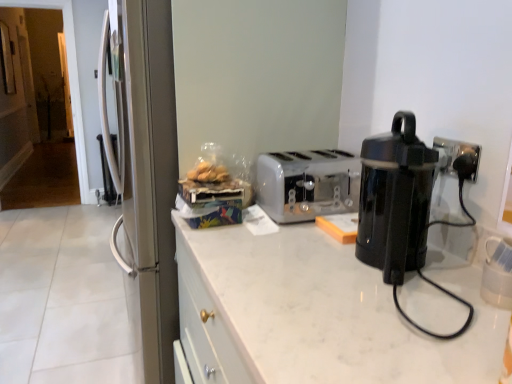
In order to click on translucent plastic bag of bread at center in this screenshot , I will do `click(208, 173)`.

Locate an element on the screen. white plastic toaster at center is located at coordinates (307, 184).

Image resolution: width=512 pixels, height=384 pixels. Describe the element at coordinates (403, 206) in the screenshot. I see `black plastic coffee pot at right` at that location.

What is the approximate height of white marble countertop at center?

white marble countertop at center is 33.45 inches tall.

Where is `translucent plastic bag of bread at center`? Image resolution: width=512 pixels, height=384 pixels. translucent plastic bag of bread at center is located at coordinates (208, 173).

How different are the orientations of white plastic toaster at center and black plastic coffee pot at right in degrees?

The angular difference between white plastic toaster at center and black plastic coffee pot at right is 89.2 degrees.

Which object is further away from the camera, white plastic toaster at center or black plastic coffee pot at right?

white plastic toaster at center is further from the camera.

Are white plastic toaster at center and black plastic coffee pot at right far apart?

No, there isn't a large distance between white plastic toaster at center and black plastic coffee pot at right.

From the image's perspective, is white plastic toaster at center on top of black plastic coffee pot at right?

Yes, from the image's perspective, white plastic toaster at center is on top of black plastic coffee pot at right.

Is white plastic toaster at center spatially inside white marble countertop at center, or outside of it?

white plastic toaster at center lies outside white marble countertop at center.

Could you tell me if white plastic toaster at center is turned towards white marble countertop at center?

No, white plastic toaster at center is not turned towards white marble countertop at center.

Locate an element on the screen. The width and height of the screenshot is (512, 384). toaster located above the white marble countertop at center (from a real-world perspective) is located at coordinates (307, 184).

Are white plastic toaster at center and translucent plastic bag of bread at center beside each other?

There is a gap between white plastic toaster at center and translucent plastic bag of bread at center.

Measure the distance from white plastic toaster at center to translucent plastic bag of bread at center.

11.41 inches.

Is white plastic toaster at center facing away from translucent plastic bag of bread at center?

That's not correct — white plastic toaster at center is not looking away from translucent plastic bag of bread at center.

From the image's perspective, is white plastic toaster at center beneath translucent plastic bag of bread at center?

Yes.

In terms of height, does white marble countertop at center look taller or shorter compared to white plastic toaster at center?

In the image, white marble countertop at center appears to be taller than white plastic toaster at center.

Which object is positioned more to the right, white marble countertop at center or white plastic toaster at center?

From the viewer's perspective, white marble countertop at center appears more on the right side.

In terms of width, does white marble countertop at center look wider or thinner when compared to white plastic toaster at center?

Clearly, white marble countertop at center has more width compared to white plastic toaster at center.

Identify the location of countertop below the white plastic toaster at center (from a real-world perspective). (315, 314).

Can you confirm if translucent plastic bag of bread at center is shorter than white plastic toaster at center?

Indeed, translucent plastic bag of bread at center has a lesser height compared to white plastic toaster at center.

Does translucent plastic bag of bread at center come behind white plastic toaster at center?

Yes, it is behind white plastic toaster at center.

I want to click on food above the white plastic toaster at center (from a real-world perspective), so click(208, 173).

Is white marble countertop at center located outside black plastic coffee pot at right?

Indeed, white marble countertop at center is completely outside black plastic coffee pot at right.

Does white marble countertop at center come in front of black plastic coffee pot at right?

Yes, white marble countertop at center is closer to the camera.

Is white marble countertop at center oriented away from black plastic coffee pot at right?

white marble countertop at center does not have its back to black plastic coffee pot at right.

Considering the relative positions of translucent plastic bag of bread at center and white marble countertop at center in the image provided, is translucent plastic bag of bread at center to the right of white marble countertop at center from the viewer's perspective?

Incorrect, translucent plastic bag of bread at center is not on the right side of white marble countertop at center.

Does translucent plastic bag of bread at center have a larger size compared to white marble countertop at center?

No.

Is white marble countertop at center a part of translucent plastic bag of bread at center?

Actually, white marble countertop at center is outside translucent plastic bag of bread at center.

Locate an element on the screen. food positioned vertically above the white marble countertop at center (from a real-world perspective) is located at coordinates (208, 173).

Identify the location of toaster that is under the black plastic coffee pot at right (from a real-world perspective). (307, 184).

Image resolution: width=512 pixels, height=384 pixels. I want to click on countertop in front of the white plastic toaster at center, so click(315, 314).

Based on the photo, considering their positions, is translucent plastic bag of bread at center positioned closer to white marble countertop at center than black plastic coffee pot at right?

Among the two, black plastic coffee pot at right is located nearer to white marble countertop at center.

From the image, which object appears to be nearer to white marble countertop at center, black plastic coffee pot at right or translucent plastic bag of bread at center?

Based on the image, black plastic coffee pot at right appears to be nearer to white marble countertop at center.

Which object lies further to the anchor point translucent plastic bag of bread at center, black plastic coffee pot at right or white marble countertop at center?

The object further to translucent plastic bag of bread at center is black plastic coffee pot at right.

Considering their positions, is white marble countertop at center positioned closer to translucent plastic bag of bread at center than white plastic toaster at center?

white plastic toaster at center lies closer to translucent plastic bag of bread at center than the other object.

Considering their positions, is black plastic coffee pot at right positioned further to translucent plastic bag of bread at center than white plastic toaster at center?

black plastic coffee pot at right is further to translucent plastic bag of bread at center.

When comparing their distances from translucent plastic bag of bread at center, does white marble countertop at center or black plastic coffee pot at right seem closer?

white marble countertop at center is positioned closer to the anchor translucent plastic bag of bread at center.

Looking at the image, which one is located closer to white plastic toaster at center, translucent plastic bag of bread at center or black plastic coffee pot at right?

translucent plastic bag of bread at center is closer to white plastic toaster at center.

Looking at the image, which one is located further to white marble countertop at center, translucent plastic bag of bread at center or white plastic toaster at center?

translucent plastic bag of bread at center lies further to white marble countertop at center than the other object.

At what (x,y) coordinates should I click in order to perform the action: click on toaster between black plastic coffee pot at right and translucent plastic bag of bread at center from front to back. Please return your answer as a coordinate pair (x, y). The width and height of the screenshot is (512, 384). Looking at the image, I should click on (307, 184).

Where is `home appliance located between white marble countertop at center and translucent plastic bag of bread at center in the depth direction`? The image size is (512, 384). home appliance located between white marble countertop at center and translucent plastic bag of bread at center in the depth direction is located at coordinates (403, 206).

Where is `toaster between white marble countertop at center and translucent plastic bag of bread at center in the front-back direction`? toaster between white marble countertop at center and translucent plastic bag of bread at center in the front-back direction is located at coordinates (307, 184).

Find the location of a particular element. Image resolution: width=512 pixels, height=384 pixels. home appliance between white marble countertop at center and white plastic toaster at center in the front-back direction is located at coordinates (403, 206).